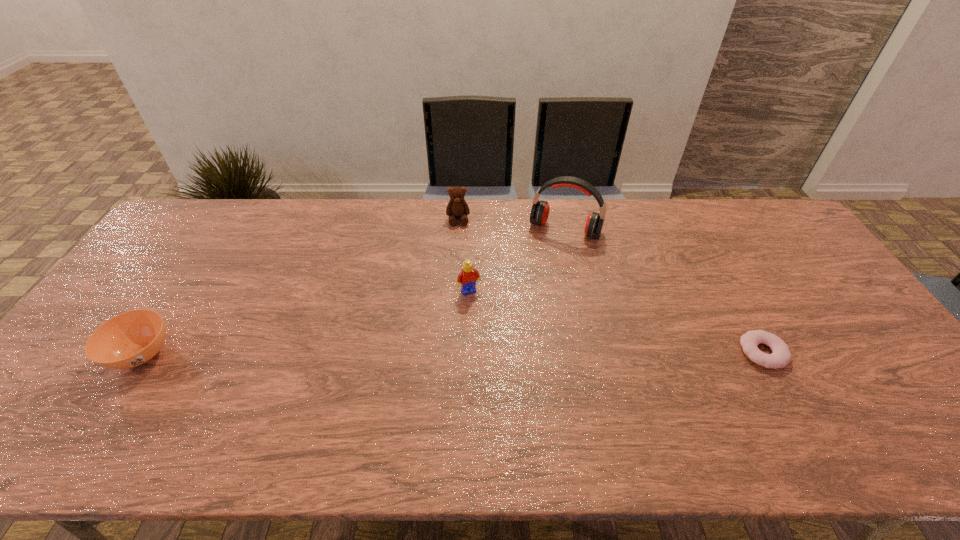
This screenshot has height=540, width=960. Identify the location of object identified as the closest to the teddy bear. (539, 214).

Where is `free spot that satisfies the following two spatial constraints: 1. on the back side of the leftmost object; 2. on the right side of the third nearest object`? free spot that satisfies the following two spatial constraints: 1. on the back side of the leftmost object; 2. on the right side of the third nearest object is located at coordinates (182, 292).

At what (x,y) coordinates should I click in order to perform the action: click on vacant space that satisfies the following two spatial constraints: 1. on the front side of the shortest object; 2. on the right side of the tallest object. Please return your answer as a coordinate pair (x, y). This screenshot has width=960, height=540. Looking at the image, I should click on (591, 353).

Find the location of a particular element. The image size is (960, 540). vacant space that satisfies the following two spatial constraints: 1. on the front side of the Lego; 2. on the left side of the teddy bear is located at coordinates (454, 292).